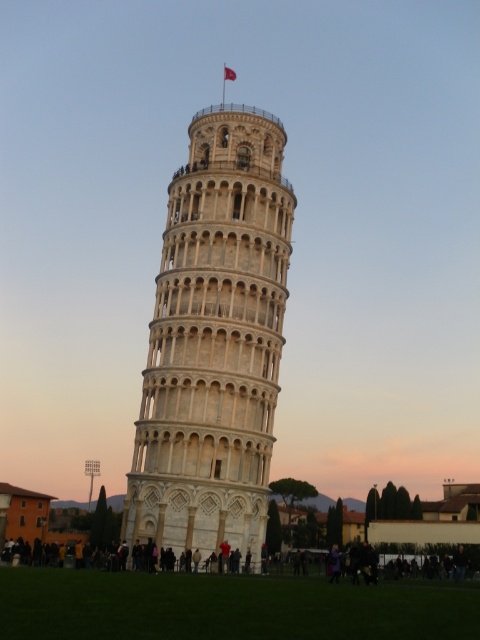
Question: Is white stone tower at center wider than red fabric flag at upper center?

Choices:
 (A) yes
 (B) no

Answer: (A)

Question: Is white stone tower at center positioned before red fabric flag at upper center?

Choices:
 (A) no
 (B) yes

Answer: (B)

Question: Which object appears farthest from the camera in this image?

Choices:
 (A) white stone tower at center
 (B) dark gray concrete people at lower center

Answer: (B)

Question: Does white stone tower at center appear under red fabric flag at upper center?

Choices:
 (A) yes
 (B) no

Answer: (A)

Question: Which point is closer to the camera taking this photo?

Choices:
 (A) (232, 70)
 (B) (240, 330)

Answer: (B)

Question: Estimate the real-world distances between objects in this image. Which object is farther from the dark gray concrete people at lower center?

Choices:
 (A) red fabric flag at upper center
 (B) white stone tower at center

Answer: (A)